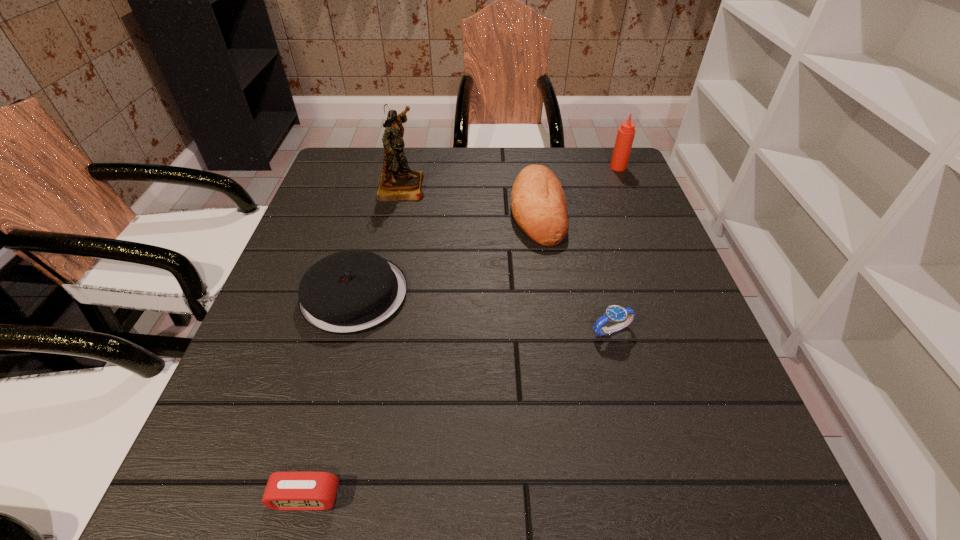
Locate an element on the screen. vacant area between the third tallest object and the nearest object is located at coordinates (421, 354).

You are a GUI agent. You are given a task and a screenshot of the screen. Output one action in this format:
    pyautogui.click(x=<x>, y=<y>)
    Task: Click on the vacant region between the bread and the farthest object
    The image size is (960, 540).
    Given the screenshot: What is the action you would take?
    pyautogui.click(x=578, y=189)

Locate an element on the screen. This screenshot has height=540, width=960. empty space between the nearest object and the pancake is located at coordinates (330, 396).

The height and width of the screenshot is (540, 960). I want to click on empty location between the tallest object and the bread, so click(469, 198).

This screenshot has width=960, height=540. Find the location of `free spot between the watch and the fourth shortest object`. free spot between the watch and the fourth shortest object is located at coordinates (574, 271).

The image size is (960, 540). I want to click on vacant area that lies between the watch and the third tallest object, so click(574, 271).

Locate an element on the screen. vacant point located between the fourth tallest object and the alarm clock is located at coordinates (330, 396).

Identify the location of free spot between the watch and the farthest object. (614, 249).

Find the location of a particular element. free point between the third tallest object and the fourth tallest object is located at coordinates pos(446,252).

Where is `object that is the fourth closest to the figurine`? This screenshot has height=540, width=960. object that is the fourth closest to the figurine is located at coordinates 623,316.